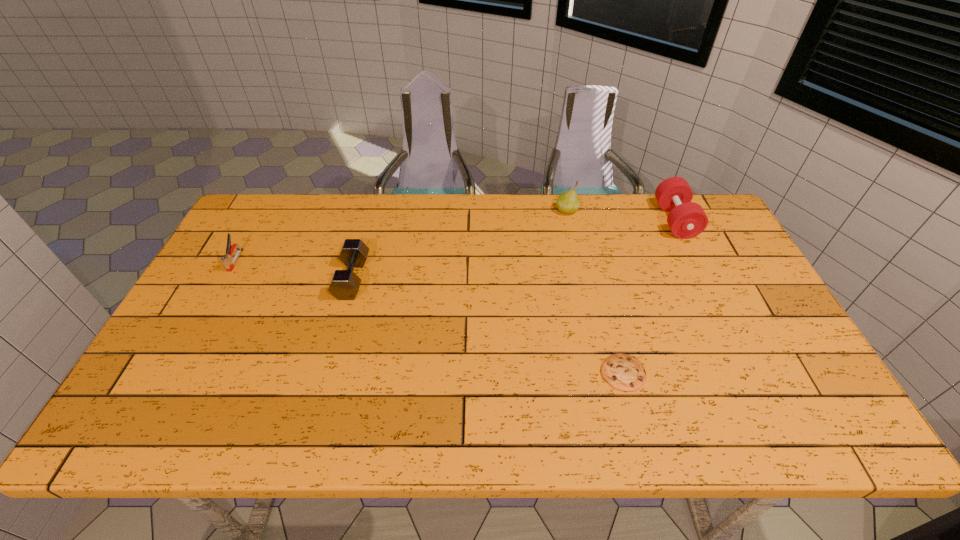
The image size is (960, 540). What are the coordinates of `free space located 0.340m on the handle side of the stapler` in the screenshot? It's located at (174, 372).

The image size is (960, 540). In order to click on blank area located on the right of the left dumbbell in this screenshot , I will do `click(391, 278)`.

Where is `vacant space located 0.300m on the right of the cookie`? Image resolution: width=960 pixels, height=540 pixels. vacant space located 0.300m on the right of the cookie is located at coordinates (770, 373).

Identify the location of pear present at the far edge. (568, 202).

Identify the location of dumbbell present at the far edge. Image resolution: width=960 pixels, height=540 pixels. (686, 219).

Locate an element on the screen. The width and height of the screenshot is (960, 540). object that is at the left edge is located at coordinates (227, 260).

Locate an element on the screen. This screenshot has height=540, width=960. object at the right edge is located at coordinates (686, 219).

Find the location of a particular element. The image size is (960, 540). object located at the far right corner is located at coordinates (686, 219).

In the image, there is a desktop. In order to click on vacant space at the far edge in this screenshot , I will do `click(451, 230)`.

This screenshot has height=540, width=960. I want to click on free region at the right edge of the desktop, so click(x=713, y=254).